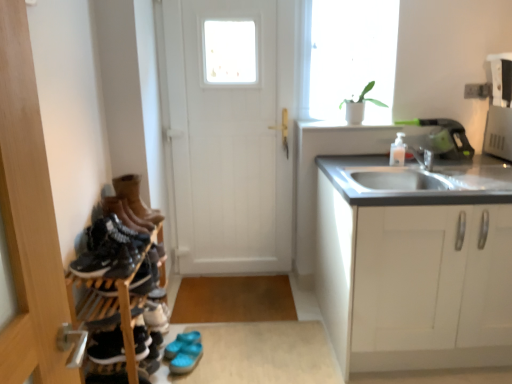
The height and width of the screenshot is (384, 512). Describe the element at coordinates (109, 250) in the screenshot. I see `black matte shoe at left, positioned as the 1th shoe in front-to-back order` at that location.

The height and width of the screenshot is (384, 512). What do you see at coordinates (125, 214) in the screenshot?
I see `leather boots at left, the third footwear in the bottom-to-top sequence` at bounding box center [125, 214].

I want to click on white matte cabinet at right, so click(414, 263).

What do you see at coordinates (414, 263) in the screenshot? I see `white matte cabinet at right` at bounding box center [414, 263].

Find the location of `transparent glass window at upper center`. transparent glass window at upper center is located at coordinates (348, 57).

From the image's perspective, would you say wooden shoe rack at left is positioned over matte black sneaker at left, positioned as the 1th shoe in back-to-front order?

No, from the image's perspective, wooden shoe rack at left is not above matte black sneaker at left, positioned as the 1th shoe in back-to-front order.

Is the depth of wooden shoe rack at left less than that of matte black sneaker at left, the 2th shoe viewed from the top?

Yes, the depth of wooden shoe rack at left is less than that of matte black sneaker at left, the 2th shoe viewed from the top.

In terms of height, does wooden shoe rack at left look taller or shorter compared to matte black sneaker at left, which is the 3th shoe from front to back?

Considering their sizes, wooden shoe rack at left has more height than matte black sneaker at left, which is the 3th shoe from front to back.

Would you say wooden shoe rack at left contains matte black sneaker at left, which is the 3th shoe from front to back?

Indeed, matte black sneaker at left, which is the 3th shoe from front to back, is located within wooden shoe rack at left.

Does point (109, 248) appear closer or farther from the camera than point (146, 281)?

Point (109, 248) is closer to the camera than point (146, 281).

How many degrees apart are the facing directions of black matte shoe at left, the 3th shoe ordered from the bottom, and matte black sneaker at left, which is the 3th shoe from front to back?

They differ by 0.673 degrees in their facing directions.

Considering the relative sizes of black matte shoe at left, the 1th shoe viewed from the top, and matte black sneaker at left, the 2th shoe from the bottom, in the image provided, is black matte shoe at left, the 1th shoe viewed from the top, shorter than matte black sneaker at left, the 2th shoe from the bottom,?

In fact, black matte shoe at left, the 1th shoe viewed from the top, may be taller than matte black sneaker at left, the 2th shoe from the bottom.

Considering the positions of objects black matte shoe at left, the 3th shoe ordered from the bottom, and matte black sneaker at left, which is the 3th shoe from front to back, in the image provided, who is in front, black matte shoe at left, the 3th shoe ordered from the bottom, or matte black sneaker at left, which is the 3th shoe from front to back,?

Positioned in front is black matte shoe at left, the 3th shoe ordered from the bottom.

From the image's perspective, between leather boots at left, the third footwear in the bottom-to-top sequence, and blue rubber sandals at lower center, acting as the 4th footwear starting from the front, which one is located above?

leather boots at left, the third footwear in the bottom-to-top sequence, appears higher in the image.

In the scene shown: Is leather boots at left, marked as the second footwear in a front-to-back arrangement, facing away from blue rubber sandals at lower center, the 4th footwear viewed from the top?

That's not correct — leather boots at left, marked as the second footwear in a front-to-back arrangement, is not looking away from blue rubber sandals at lower center, the 4th footwear viewed from the top.

From the leather boots at left, the third footwear in the bottom-to-top sequence, count 2nd footwears backward and point to it. Please provide its 2D coordinates.

[(184, 352)]

How far apart are leather boots at left, the second footwear from the top, and blue rubber sandals at lower center, which is counted as the first footwear, starting from the bottom?

The distance of leather boots at left, the second footwear from the top, from blue rubber sandals at lower center, which is counted as the first footwear, starting from the bottom, is 26.94 inches.

How different are the orientations of leather boots at left, which is the third footwear from front to back, and white matte door at center in degrees?

They differ by 79.7 degrees in their facing directions.

From a real-world perspective, is leather boots at left, which appears as the second footwear when viewed from the back, over white matte door at center?

No, from a real-world perspective, leather boots at left, which appears as the second footwear when viewed from the back, is not on top of white matte door at center.

Considering the relative positions of leather boots at left, arranged as the 4th footwear when ordered from the bottom, and white matte door at center in the image provided, is leather boots at left, arranged as the 4th footwear when ordered from the bottom, to the right of white matte door at center from the viewer's perspective?

In fact, leather boots at left, arranged as the 4th footwear when ordered from the bottom, is to the left of white matte door at center.

Considering the sizes of objects leather boots at left, arranged as the 4th footwear when ordered from the bottom, and white matte door at center in the image provided, who is thinner, leather boots at left, arranged as the 4th footwear when ordered from the bottom, or white matte door at center?

white matte door at center.

Which point is more forward, (x=120, y=315) or (x=134, y=225)?

The point (x=120, y=315) is in front.

Is black leather shoe at left, positioned as the 2th shoe in back-to-front order, inside the boundaries of leather boots at left, the second footwear from the top, or outside?

The correct answer is: outside.

Between black leather shoe at left, positioned as the 2th shoe in back-to-front order, and leather boots at left, the second footwear from the top, which one has larger size?

leather boots at left, the second footwear from the top.

From the picture: From a real-world perspective, does white matte cabinet at right stand above matte black sneaker at left, the 2th shoe from the bottom?

Incorrect, from a real-world perspective, white matte cabinet at right is lower than matte black sneaker at left, the 2th shoe from the bottom.

Could you tell me if white matte cabinet at right is turned towards matte black sneaker at left, the 2th shoe from the bottom?

No, white matte cabinet at right is not oriented towards matte black sneaker at left, the 2th shoe from the bottom.

Between white matte cabinet at right and matte black sneaker at left, the 2th shoe viewed from the top, which one has smaller size?

matte black sneaker at left, the 2th shoe viewed from the top, is smaller.

Does white matte cabinet at right come in front of matte black sneaker at left, the 2th shoe from the bottom?

Yes, white matte cabinet at right is in front of matte black sneaker at left, the 2th shoe from the bottom.

The height and width of the screenshot is (384, 512). Find the location of `cabinetry that appears above the black leather shoe at left, positioned as the 2th shoe in back-to-front order (from the image's perspective)`. cabinetry that appears above the black leather shoe at left, positioned as the 2th shoe in back-to-front order (from the image's perspective) is located at coordinates (414, 263).

Is black leather shoe at left, acting as the 3th shoe starting from the top, facing away from white matte cabinet at right?

black leather shoe at left, acting as the 3th shoe starting from the top, does not have its back to white matte cabinet at right.

From a real-world perspective, does black leather shoe at left, the second shoe from the front, stand above white matte cabinet at right?

Correct, in the physical world, black leather shoe at left, the second shoe from the front, is higher than white matte cabinet at right.

In the scene shown: From the image's perspective, is black leather shoe at left, positioned as the 2th shoe in back-to-front order, positioned above or below white matte cabinet at right?

black leather shoe at left, positioned as the 2th shoe in back-to-front order, is below white matte cabinet at right.

Identify the location of shelf below the matte black sneaker at left, positioned as the 1th shoe in back-to-front order (from a real-world perspective). (117, 282).

At what (x,y) coordinates should I click in order to perform the action: click on shoe above the matte black sneaker at left, positioned as the 1th shoe in back-to-front order (from the image's perspective). Please return your answer as a coordinate pair (x, y). This screenshot has height=384, width=512. Looking at the image, I should click on (109, 250).

Looking at the image, which one is located closer to black matte shoe at left, which is the third shoe from back to front, leather boots at left, which appears as the second footwear when viewed from the back, or leather boots at left, marked as the second footwear in a front-to-back arrangement?

The object closer to black matte shoe at left, which is the third shoe from back to front, is leather boots at left, marked as the second footwear in a front-to-back arrangement.

Considering their positions, is black leather shoe at left, the first shoe when ordered from bottom to top, positioned closer to black matte shoe at left, the 1th shoe viewed from the top, than white matte cabinet at right?

Among the two, black leather shoe at left, the first shoe when ordered from bottom to top, is located nearer to black matte shoe at left, the 1th shoe viewed from the top.

Considering their positions, is black matte shoe at left, the 3th shoe ordered from the bottom, positioned further to leather boots at left, acting as the 1th footwear starting from the top, than black leather shoe at left, the first shoe when ordered from bottom to top?

black leather shoe at left, the first shoe when ordered from bottom to top, lies further to leather boots at left, acting as the 1th footwear starting from the top, than the other object.

Estimate the real-world distances between objects in this image. Which object is further from black leather shoe at left, acting as the 3th shoe starting from the top, transparent glass window at upper center or leather boots at left, the third footwear in the bottom-to-top sequence?

transparent glass window at upper center.

Which object lies nearer to the anchor point white matte door at center, leather boots at left, which ranks as the 3th footwear in back-to-front order, or wooden shoe rack at left?

wooden shoe rack at left is positioned closer to the anchor white matte door at center.

Which object lies further to the anchor point blue rubber sandals at lower center, which is counted as the first footwear, starting from the bottom, transparent glass window at upper center or black suede sneakers at lower left, which is the second footwear from bottom to top?

transparent glass window at upper center.

Which object lies nearer to the anchor point black matte shoe at left, the 3th shoe ordered from the bottom, white matte door at center or leather boots at left, arranged as the 4th footwear when ordered from the bottom?

leather boots at left, arranged as the 4th footwear when ordered from the bottom, is closer to black matte shoe at left, the 3th shoe ordered from the bottom.

Looking at this image, looking at the image, which one is located closer to transparent glass window at upper center, matte black sneaker at left, which is the 3th shoe from front to back, or white matte cabinet at right?

white matte cabinet at right lies closer to transparent glass window at upper center than the other object.

The width and height of the screenshot is (512, 384). I want to click on door between transparent glass window at upper center and blue rubber sandals at lower center, which is counted as the first footwear, starting from the bottom, from top to bottom, so click(x=232, y=132).

Find the location of a particular element. This screenshot has height=384, width=512. footwear between leather boots at left, which is the third footwear from front to back, and black suede sneakers at lower left, the fourth footwear when ordered from back to front, in the vertical direction is located at coordinates (125, 214).

This screenshot has width=512, height=384. I want to click on door situated between wooden shoe rack at left and white matte cabinet at right from left to right, so click(x=232, y=132).

This screenshot has height=384, width=512. I want to click on door located between black suede sneakers at lower left, placed as the 3th footwear when sorted from top to bottom, and white matte cabinet at right in the left-right direction, so click(232, 132).